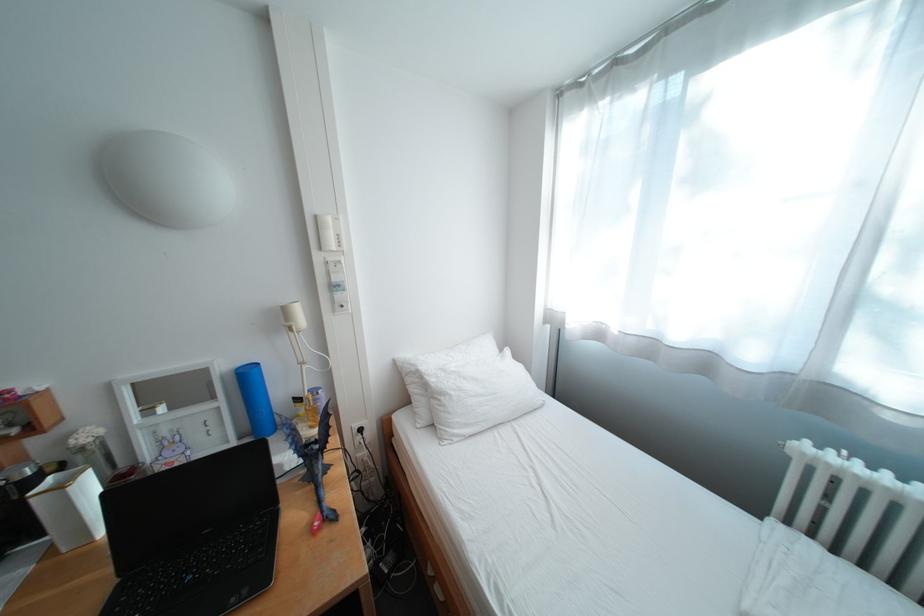
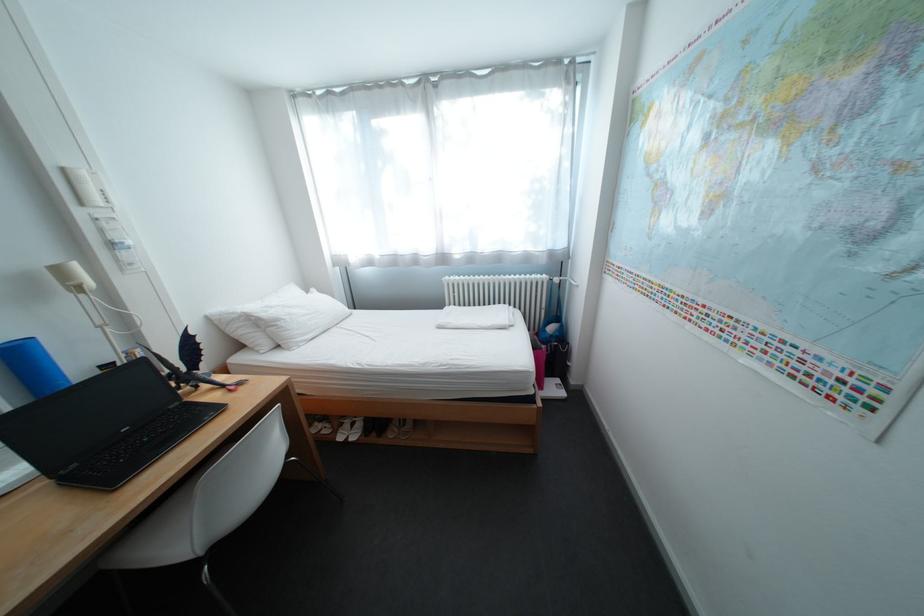
Question: I am providing you with two images of the same scene from different viewpoints. Which of the following objects are not visible in image2?

Choices:
 (A) blue foam roller
 (B) pair of white sandals
 (C) white pillow
 (D) none of these

Answer: (D)